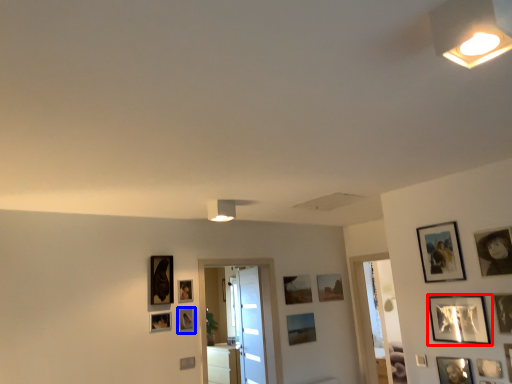
Question: Which object is further to the camera taking this photo, picture frame (highlighted by a red box) or picture frame (highlighted by a blue box)?

Choices:
 (A) picture frame
 (B) picture frame

Answer: (B)